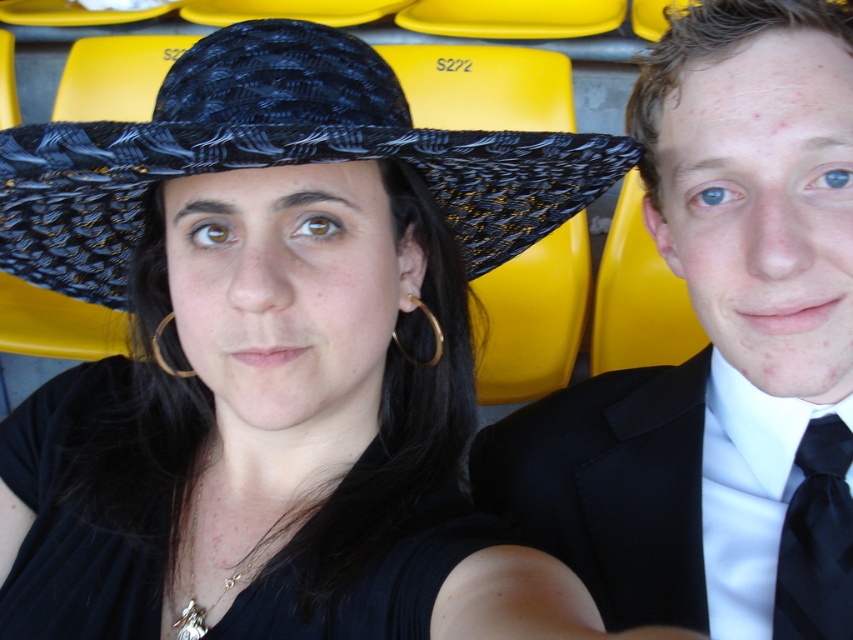
You are trying to decide whether to sit in the seat next to the matte black suit at center. Based on the image, will you be sitting in front of or behind the black woven hat at center?

The matte black suit at center is positioned under the black woven hat at center, so sitting next to the matte black suit at center would place you in front of the black woven hat at center.

You are a photographer preparing for a group photo and need to ensure that the matte black suit at center and the black silk tie at right are both visible in the frame. Considering their sizes, which object should you focus on to ensure both are properly captured?

The matte black suit at center is larger in size than the black silk tie at right, so focusing on the matte black suit at center will ensure both objects are properly captured in the frame.